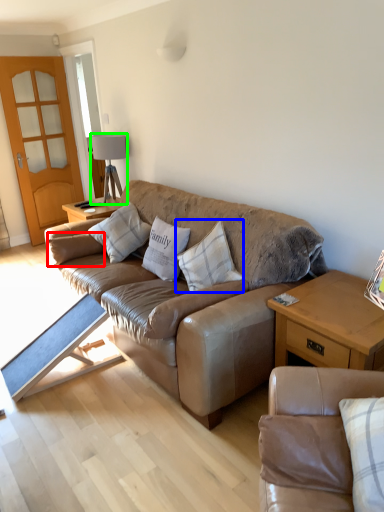
Question: Which object is the farthest from pillow (highlighted by a red box)? Choose among these: pillow (highlighted by a blue box) or lamp (highlighted by a green box).

Choices:
 (A) pillow
 (B) lamp

Answer: (A)